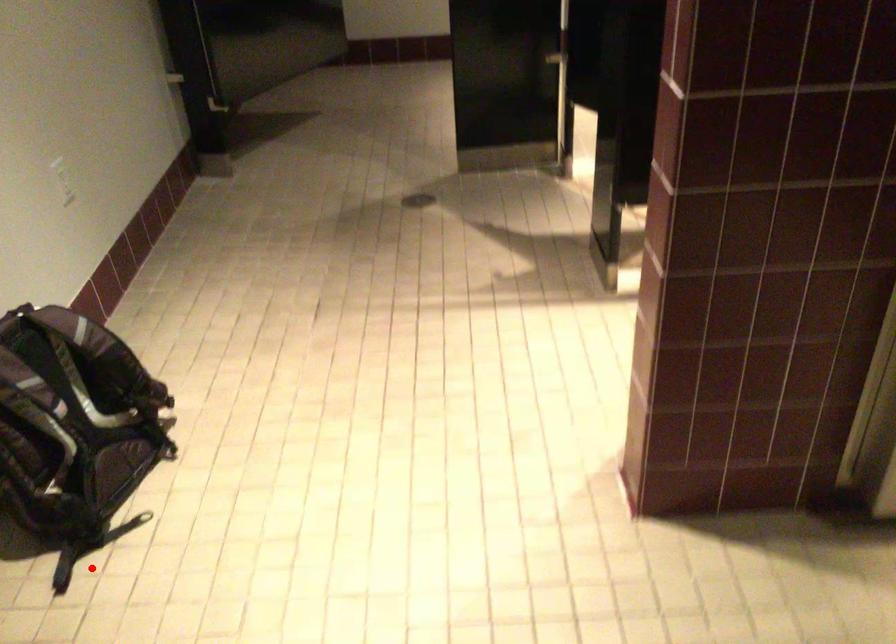
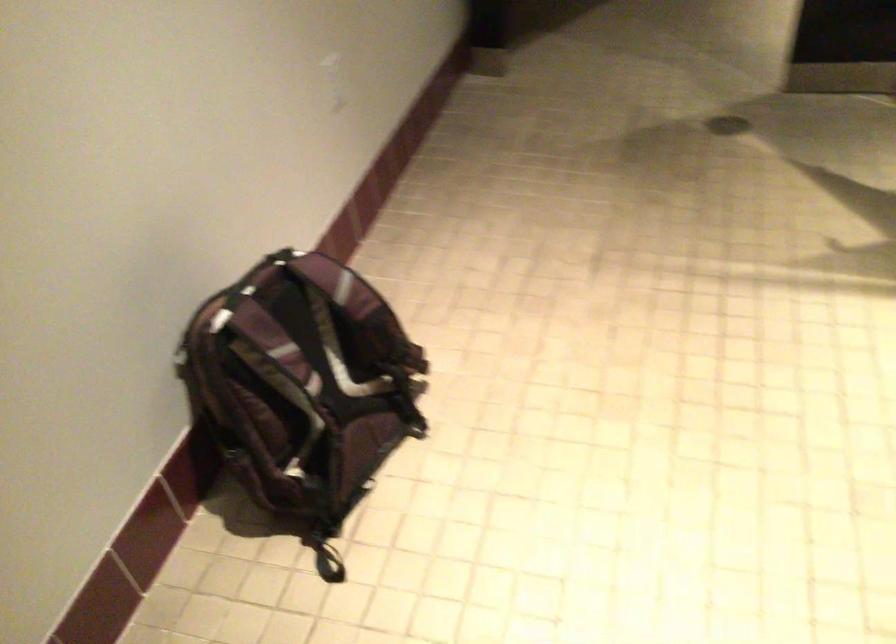
Locate, in the second image, the point that corresponds to the highlighted location in the first image.

(328, 567)